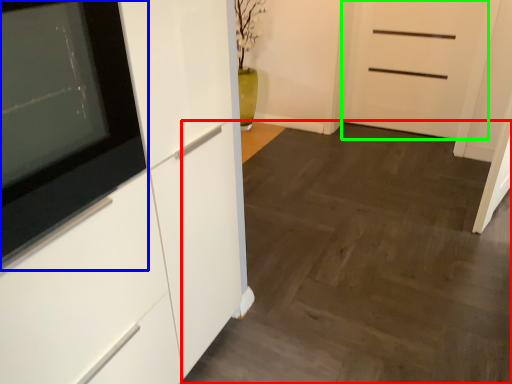
Question: Which is farther away from plain (highlighted by a red box)? appliance (highlighted by a blue box) or door (highlighted by a green box)?

Choices:
 (A) appliance
 (B) door

Answer: (A)